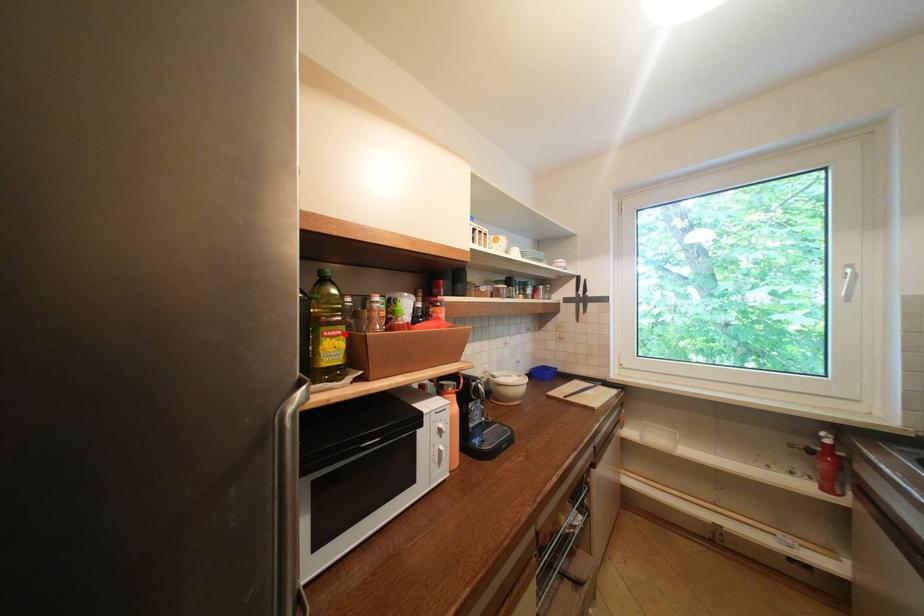
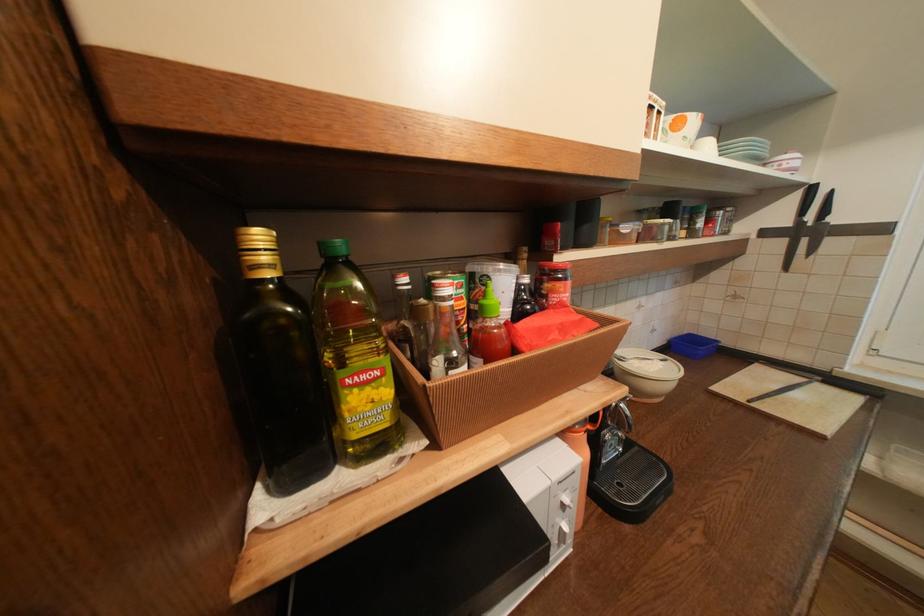
In the second image, find the point that corresponds to the highlighted location in the first image.

(379, 377)